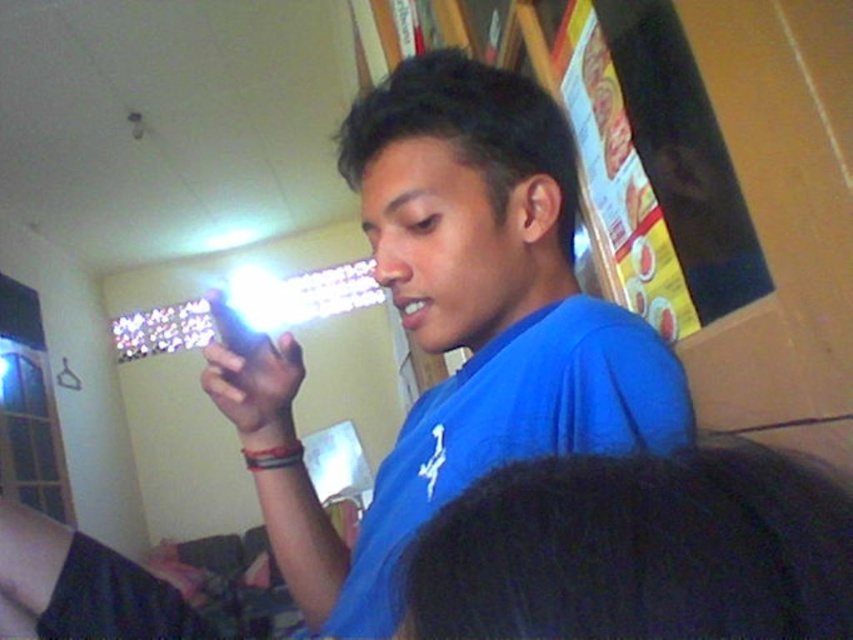
Looking at this image, does blue matte shirt at center lie in front of matte black phone at center?

Yes.

You are a GUI agent. You are given a task and a screenshot of the screen. Output one action in this format:
    pyautogui.click(x=<x>, y=<y>)
    Task: Click on the blue matte shirt at center
    
    Given the screenshot: What is the action you would take?
    pyautogui.click(x=468, y=324)